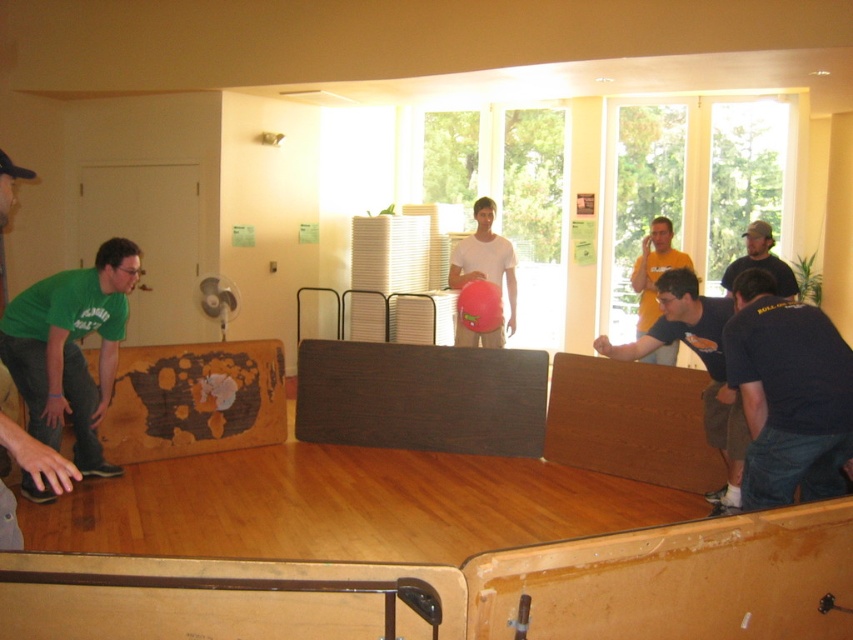
Question: Which point is farther from the camera taking this photo?

Choices:
 (A) (80, 420)
 (B) (758, 221)
 (C) (724, 408)

Answer: (B)

Question: Can you confirm if wooden board at right is positioned above yellow t-shirt at upper center?

Choices:
 (A) yes
 (B) no

Answer: (B)

Question: Does dark blue t-shirt at lower right appear on the right side of dark blue t-shirt at right?

Choices:
 (A) no
 (B) yes

Answer: (A)

Question: Which object appears closest to the camera in this image?

Choices:
 (A) white matte shirt at center
 (B) dark blue t-shirt at lower right
 (C) wooden board at right

Answer: (B)

Question: Which object appears closest to the camera in this image?

Choices:
 (A) yellow t-shirt at upper center
 (B) green matte shirt at lower left
 (C) dark blue t-shirt at right
 (D) wooden board at right

Answer: (D)

Question: Does dark blue t-shirt at lower right appear on the right side of white matte shirt at center?

Choices:
 (A) yes
 (B) no

Answer: (A)